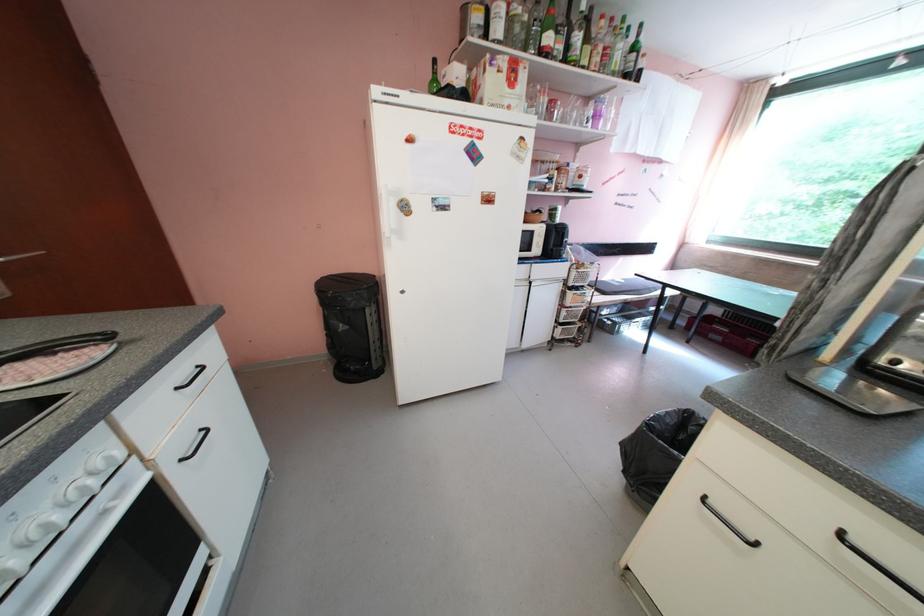
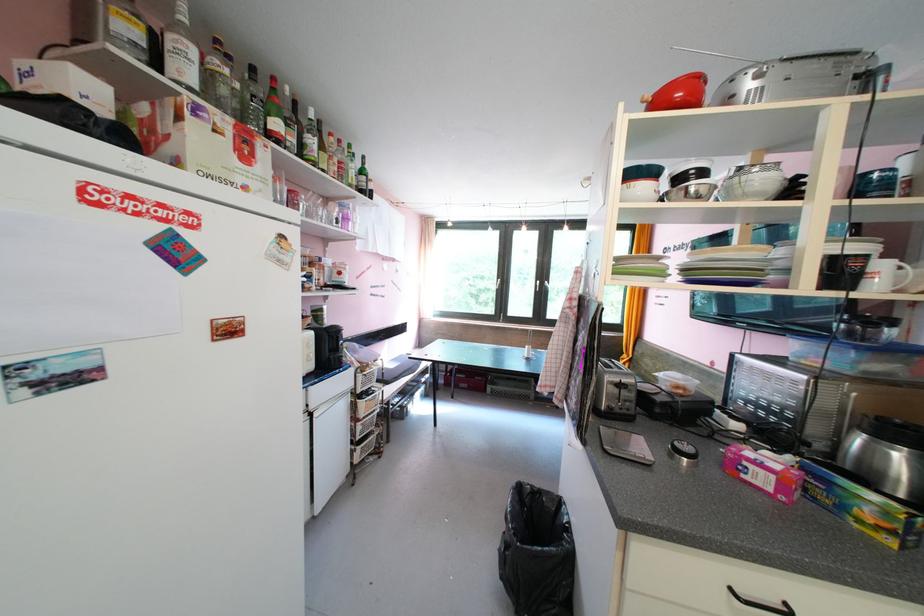
Question: The first image is from the beginning of the video and the second image is from the end. How did the camera likely rotate when shooting the video?

Choices:
 (A) Left
 (B) Right
 (C) Up
 (D) Down

Answer: (B)